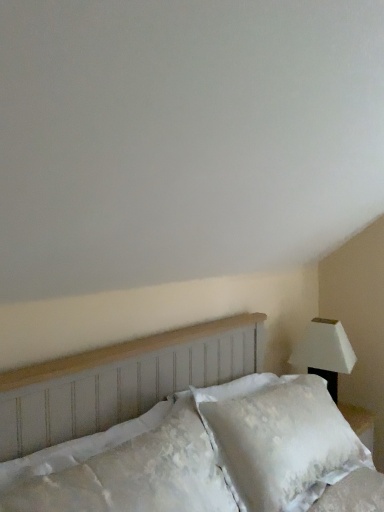
Question: From the image's perspective, relative to white textured headboard at center, is white textured pillow at lower left above or below?

Choices:
 (A) above
 (B) below

Answer: (A)

Question: Would you say white textured pillow at lower left is to the left or to the right of white textured headboard at center in the picture?

Choices:
 (A) right
 (B) left

Answer: (B)

Question: Which of these objects is positioned closest to the white textured headboard at center?

Choices:
 (A) white textured pillow at lower left
 (B) white matte lamp at right

Answer: (A)

Question: Considering the real-world distances, which object is farthest from the white textured pillow at lower left?

Choices:
 (A) white textured headboard at center
 (B) white matte lamp at right

Answer: (B)